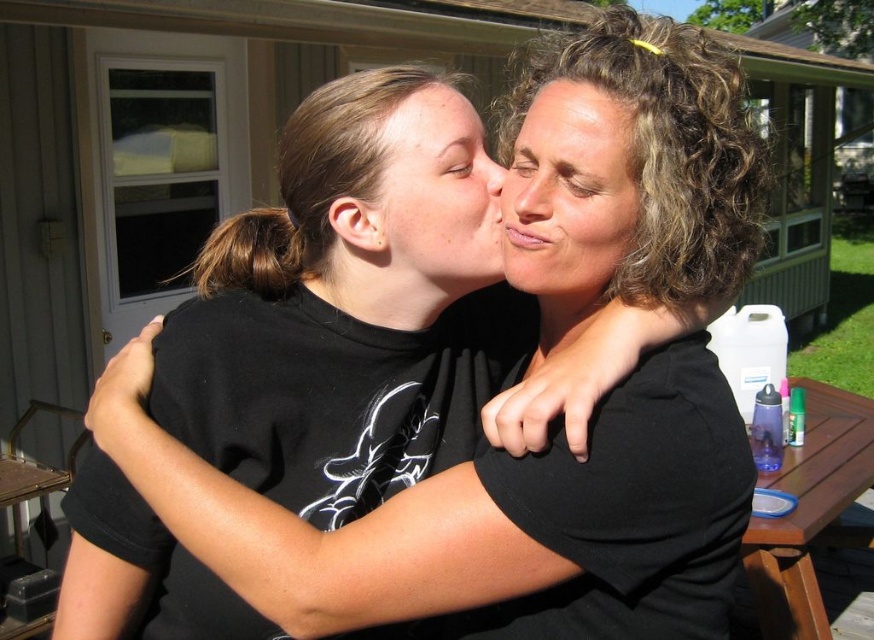
Question: Which point is farther to the camera?

Choices:
 (A) (538, 109)
 (B) (587, 132)

Answer: (A)

Question: Is curly hair at center smaller than brown wooden picnic table at right?

Choices:
 (A) no
 (B) yes

Answer: (B)

Question: Among these points, which one is nearest to the camera?

Choices:
 (A) (548, 83)
 (B) (852, 467)

Answer: (A)

Question: Which object is closer to the camera taking this photo?

Choices:
 (A) matte brown hair at upper center
 (B) matte black face at center
 (C) curly hair at center

Answer: (C)

Question: Does brown wooden picnic table at right appear under matte brown hair at upper center?

Choices:
 (A) yes
 (B) no

Answer: (A)

Question: Observing the image, what is the correct spatial positioning of matte black face at center in reference to brown wooden picnic table at right?

Choices:
 (A) below
 (B) above

Answer: (B)